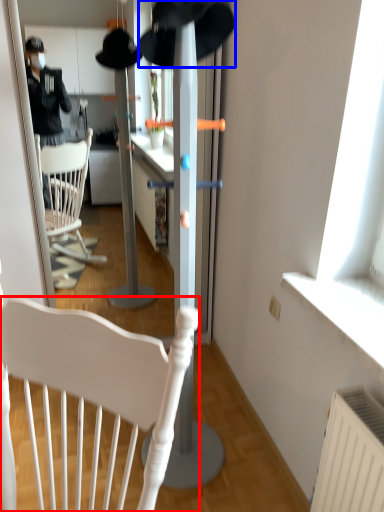
Question: Which object appears farthest to the camera in this image, chair (highlighted by a red box) or hat (highlighted by a blue box)?

Choices:
 (A) chair
 (B) hat

Answer: (A)